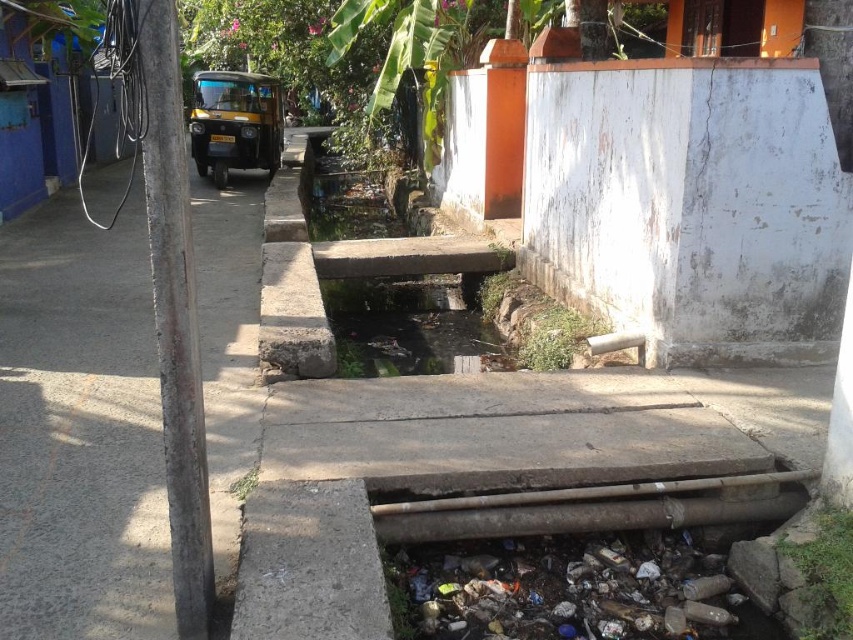
Question: Does gray concrete pavement at left appear on the right side of clear concrete water at center?

Choices:
 (A) no
 (B) yes

Answer: (A)

Question: Does gray concrete pavement at left have a larger size compared to clear concrete water at center?

Choices:
 (A) no
 (B) yes

Answer: (A)

Question: Which of the following is the closest to the observer?

Choices:
 (A) gray concrete pavement at left
 (B) clear concrete water at center

Answer: (B)

Question: Is gray concrete pavement at left to the left of clear concrete water at center from the viewer's perspective?

Choices:
 (A) yes
 (B) no

Answer: (A)

Question: Which of the following is the farthest from the observer?

Choices:
 (A) clear concrete water at center
 (B) gray concrete pavement at left

Answer: (B)

Question: Among these objects, which one is nearest to the camera?

Choices:
 (A) clear concrete water at center
 (B) gray concrete pavement at left

Answer: (A)